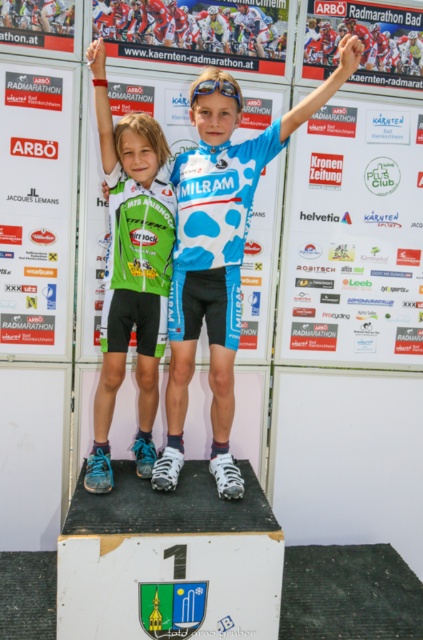
What is the spatial relationship between the matte blue jersey at center and the other objects in the scene?

The matte blue jersey at center is positioned at coordinates point0.[219,639], but without additional object positions, its exact spatial relation to others can only be inferred through the scene description.

You are a photographer standing in front of the podium. You need to capture a photo where both the matte blue jersey at center and the green matte jersey at center are clearly visible. Which jersey should you focus on to ensure the other remains in the frame?

You should focus on the matte blue jersey at center because it is larger and will be more prominent in the frame, ensuring the smaller green matte jersey at center remains visible.